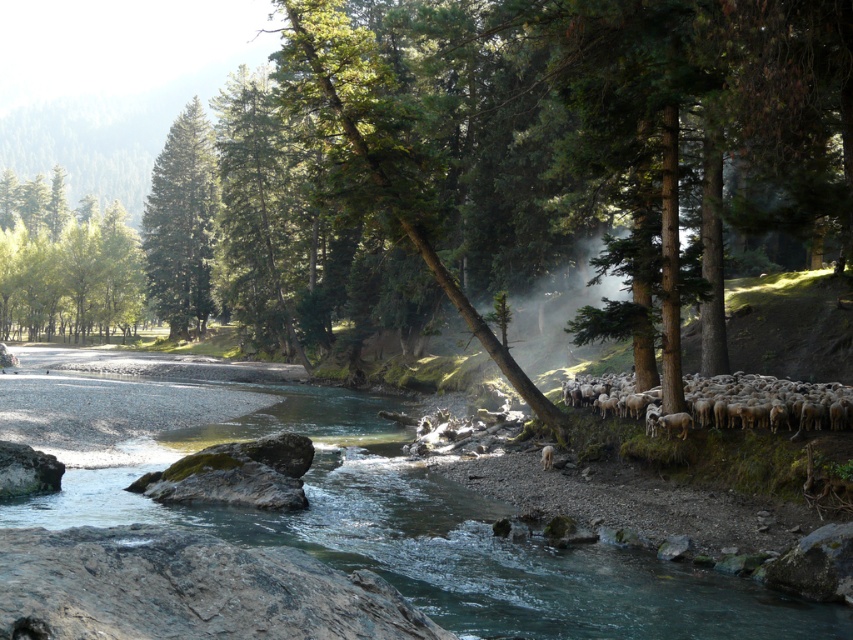
Consider the image. You are planning to cross the river using a small wooden bridge that can only support objects wider than the green matte tree at upper left. Can the clear water at river right fit under the bridge?

The clear water at river right is wider than the green matte tree at upper left, so the bridge can support it as it is wider than the minimum requirement.

You are a photographer standing at the riverbank and want to capture both the point at location (x=361, y=448) and the point at (x=207, y=202) in your photo. Which point will appear larger in your camera view?

Point (x=361, y=448) is closer to the camera than point (x=207, y=202), so it will appear larger in the photo.

Consider the image. You are standing at the edge of the river in the forest scene. You notice two points marked in the image. Which point, point (132, 310) or point (747, 394), is closer to you?

Point (132, 310) is closer to you because it is further to the viewer than point (747, 394).